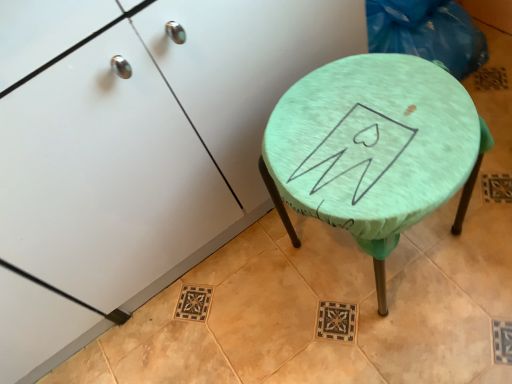
Identify the location of vacant space that is to the left of teal fabric-covered stool at center. The image size is (512, 384). (272, 299).